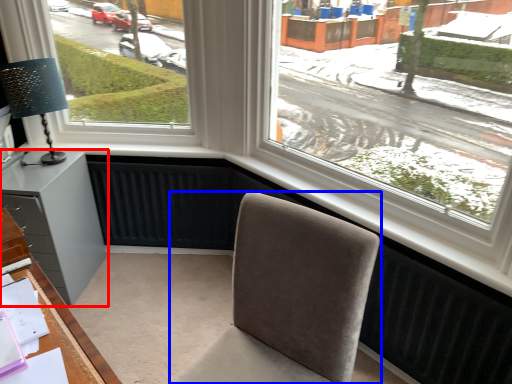
Question: Which of the following is the farthest to the observer, cabinetry (highlighted by a red box) or chair (highlighted by a blue box)?

Choices:
 (A) cabinetry
 (B) chair

Answer: (A)